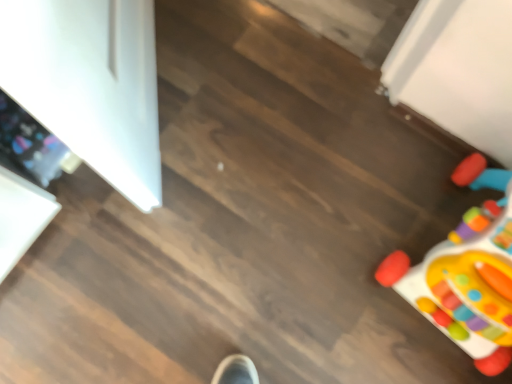
The height and width of the screenshot is (384, 512). What do you see at coordinates (465, 286) in the screenshot?
I see `plastic colorful toy at lower right` at bounding box center [465, 286].

This screenshot has width=512, height=384. Find the location of `plastic colorful toy at lower right`. plastic colorful toy at lower right is located at coordinates (465, 286).

The height and width of the screenshot is (384, 512). Find the location of `plastic colorful toy at lower right`. plastic colorful toy at lower right is located at coordinates (465, 286).